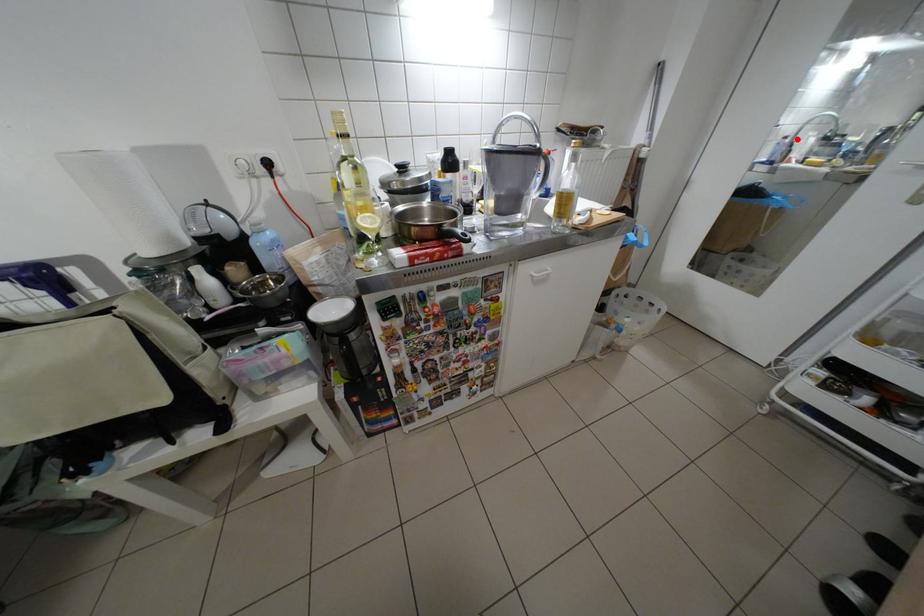
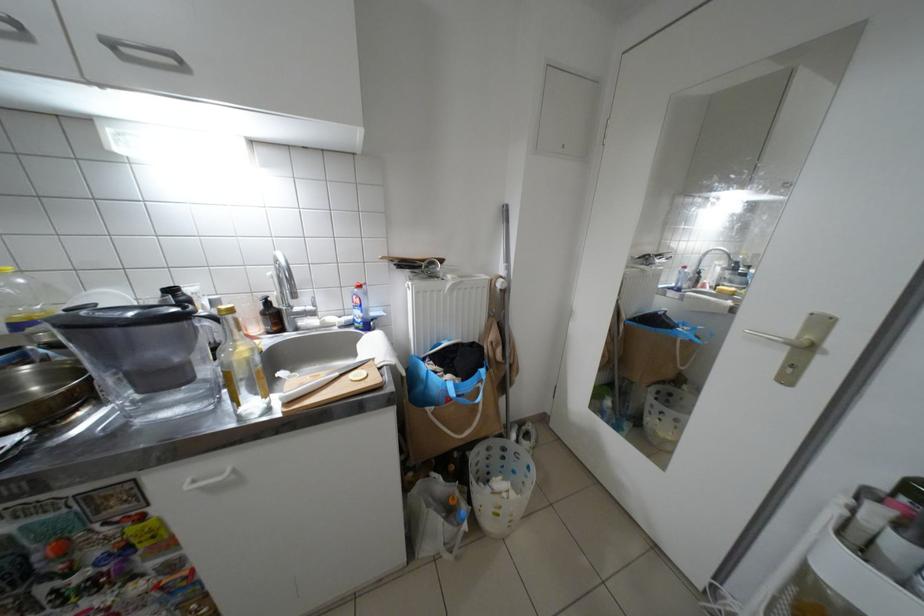
Question: A red point is marked in image1. In image2, is the corresponding 3D point closer to the camera or farther? Reply with the corresponding letter.

Choices:
 (A) The corresponding 3D point is closer.
 (B) The corresponding 3D point is farther.

Answer: (A)